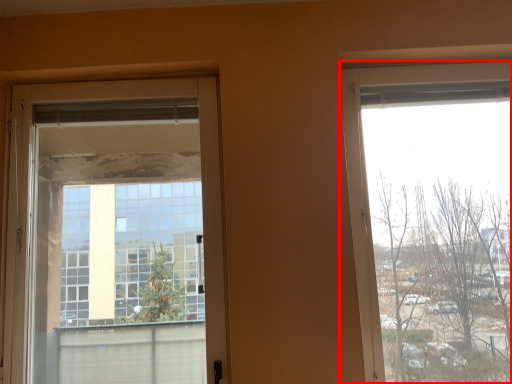
Question: From the image's perspective, where is window (annotated by the red box) located relative to door?

Choices:
 (A) above
 (B) below

Answer: (A)